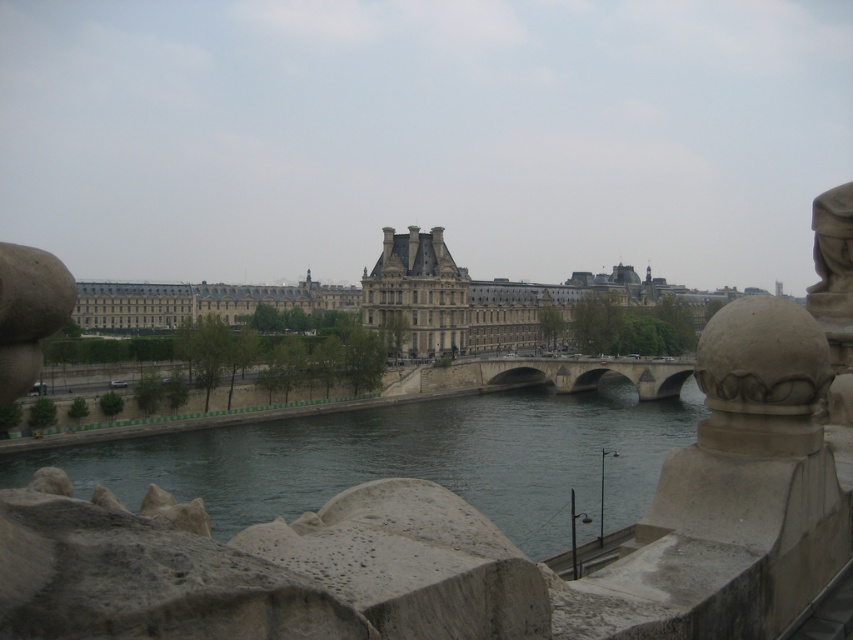
Question: Estimate the real-world distances between objects in this image. Which object is closer to the green stone river at center?

Choices:
 (A) stone bridge at center
 (B) smooth stone statue at upper right

Answer: (A)

Question: Does green stone river at center appear over smooth stone statue at upper right?

Choices:
 (A) yes
 (B) no

Answer: (B)

Question: Considering the relative positions of beige stone palace at center and smooth stone statue at upper right in the image provided, where is beige stone palace at center located with respect to smooth stone statue at upper right?

Choices:
 (A) above
 (B) below

Answer: (B)

Question: Which point is farther to the camera?

Choices:
 (A) beige stone palace at center
 (B) green stone river at center

Answer: (A)

Question: Which of the following is the farthest from the observer?

Choices:
 (A) smooth stone sculpture at left
 (B) green stone river at center
 (C) smooth stone statue at upper right

Answer: (B)

Question: Can you confirm if beige stone palace at center is wider than smooth stone sculpture at left?

Choices:
 (A) yes
 (B) no

Answer: (A)